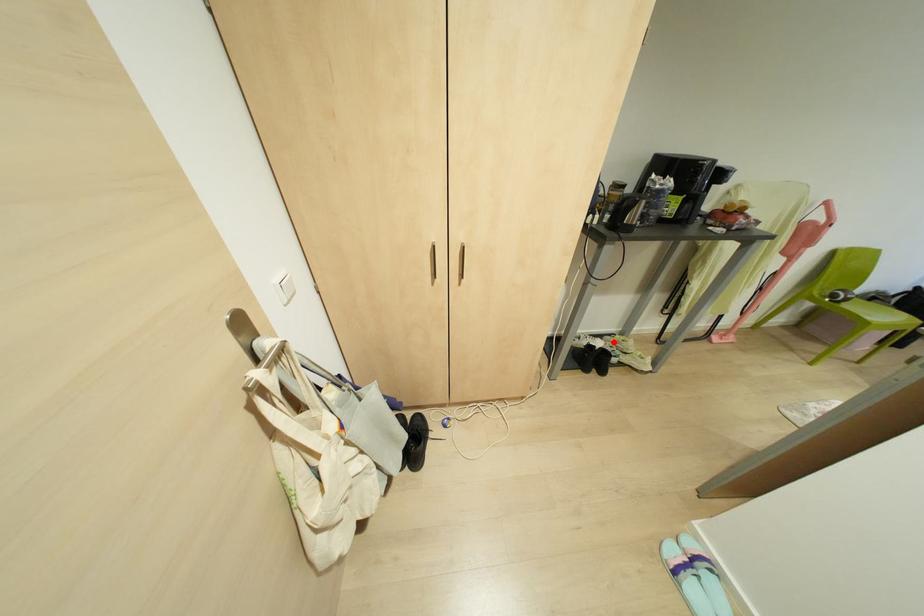
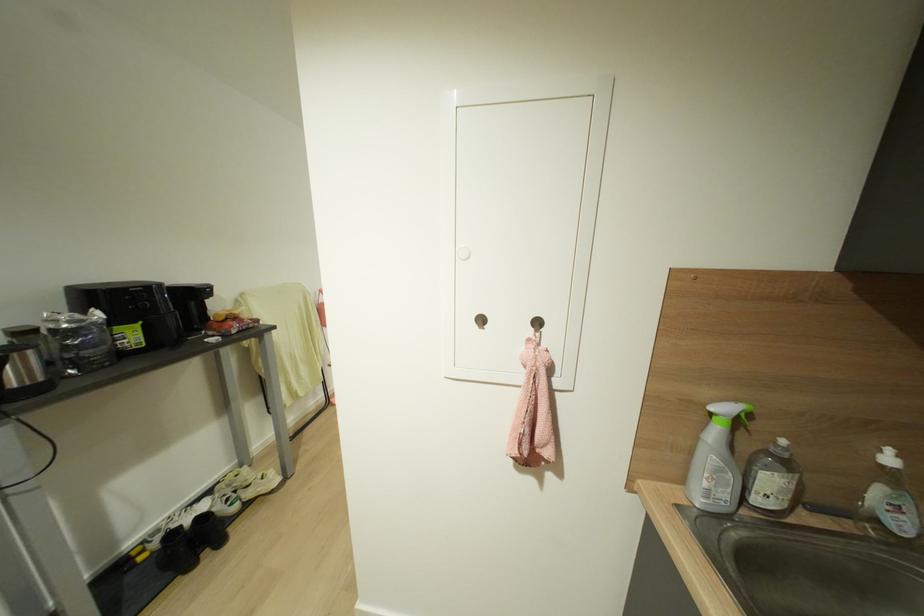
Question: I am providing you with two images of the same scene from different viewpoints. A red point is shown in image1. For the corresponding object point in image2, is it positioned nearer or farther from the camera?

Choices:
 (A) Nearer
 (B) Farther

Answer: (A)